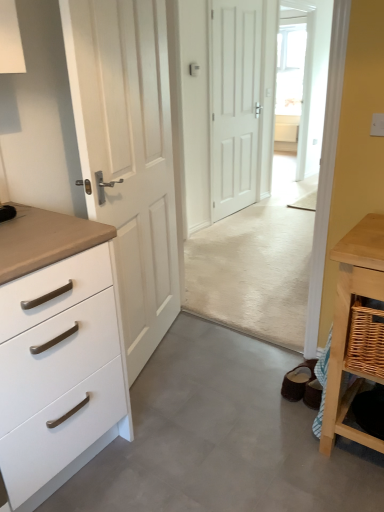
Find the location of a particular element. free space in front of white matte door at center, marked as the 2th door in a left-to-right arrangement is located at coordinates (256, 224).